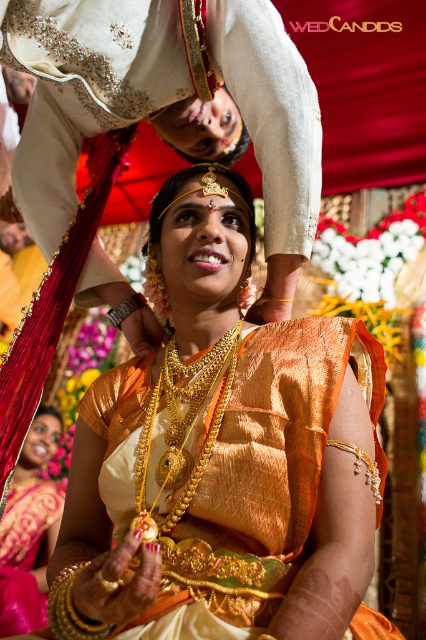
Question: Based on their relative distances, which object is nearer to the shiny gold necklace at center?

Choices:
 (A) golden ornate necklace at center
 (B) matte gold necklace at center

Answer: (A)

Question: Is shiny gold necklace at center wider than golden ornate necklace at center?

Choices:
 (A) yes
 (B) no

Answer: (B)

Question: Considering the relative positions of shiny gold necklace at center and golden ornate necklace at center in the image provided, where is shiny gold necklace at center located with respect to golden ornate necklace at center?

Choices:
 (A) below
 (B) above

Answer: (A)

Question: Which of the following is the farthest from the observer?

Choices:
 (A) matte gold necklace at center
 (B) golden ornate necklace at center

Answer: (A)

Question: Among these points, which one is farthest from the camera?

Choices:
 (A) (16, 180)
 (B) (36, 548)
 (C) (340, 628)

Answer: (B)

Question: Does shiny gold necklace at center have a lesser width compared to matte gold necklace at center?

Choices:
 (A) no
 (B) yes

Answer: (A)